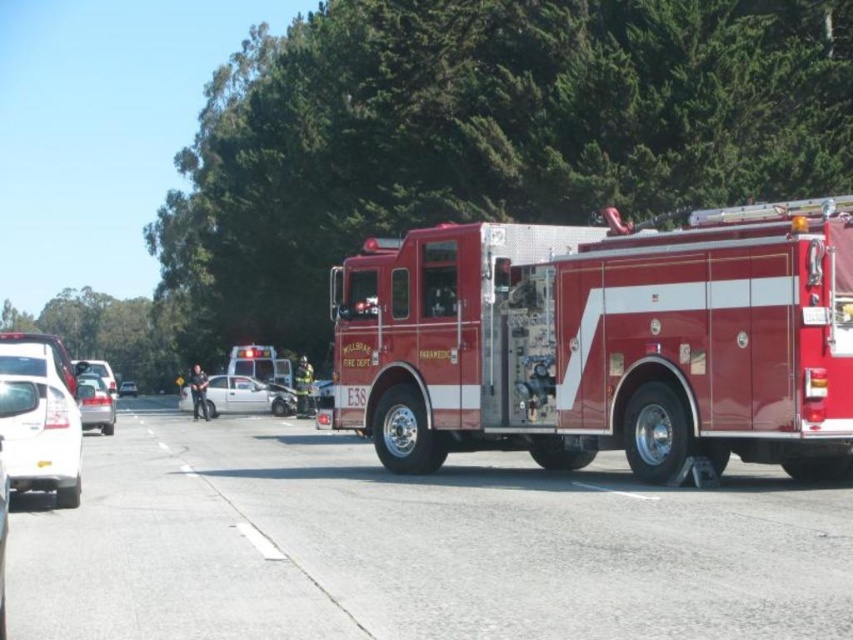
You are a parking attendant and need to park both the shiny red fire truck at center and the white glossy sedan at center in two adjacent parking spots. The parking spots are exactly 2 meters wide each. Can both vehicles fit into their respective spots without overlapping?

The shiny red fire truck at center might be wider than white glossy sedan at center. Since the parking spots are only 2 meters wide each, if the fire truck exceeds 2 meters in width, it won let you park both without overlapping. However, the sedan should fit as it is narrower. You need to measure the fire truck first to confirm.

You are a pedestrian standing at the crosswalk near the road where the white glossy sedan at lower left and the silver metallic sedan at left are parked. You need to cross the road to reach the fire truck labeled Willowbrae Fire Dept. E38. Which sedan should you move around to safely cross the road?

The white glossy sedan at lower left is in front of the silver metallic sedan at left, so you should move around the white glossy sedan at lower left to safely cross the road since it is closer to you.

You are a pedestrian standing at the crosswalk and see the white glossy sedan at lower left and the silver metallic sedan at left. Which car is taller?

The white glossy sedan at lower left is taller than the silver metallic sedan at left.